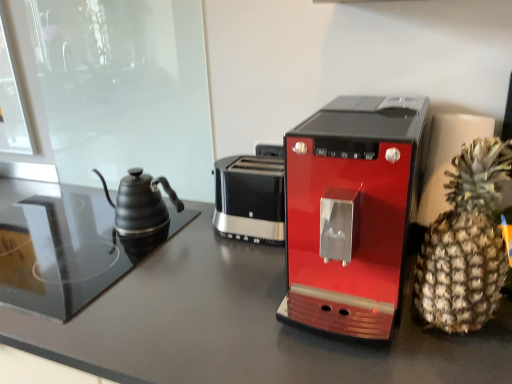
Locate an element on the screen. This screenshot has width=512, height=384. free spot in front of black plastic toaster at center is located at coordinates (232, 267).